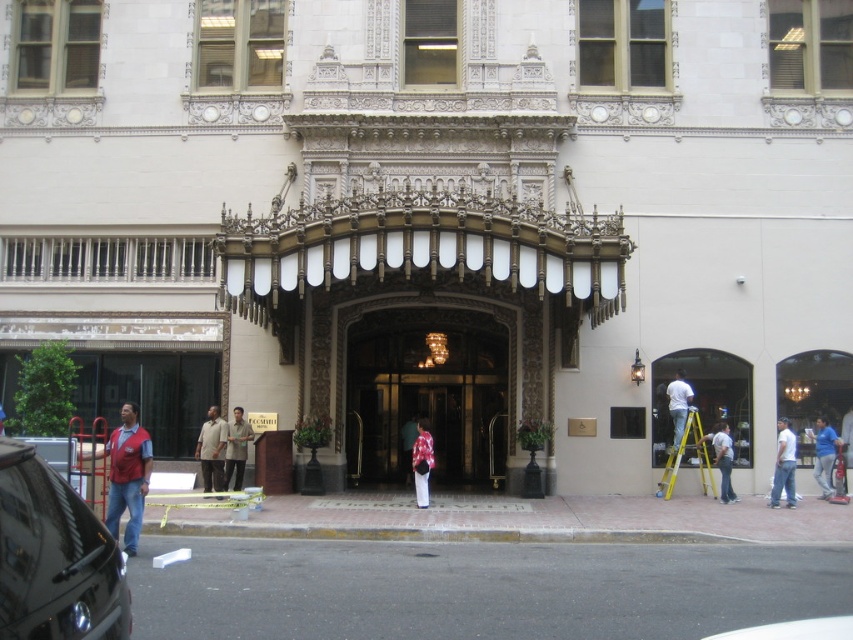
You are standing outside the grand building entrance and see both the clear glass window at center and the floral fabric dress at center. Which object is closer to you?

The clear glass window at center is closer to you because the floral fabric dress at center is behind it.

You are standing at the entrance of the grand building and want to locate two specific points marked on the facade. The first point is at coordinate point (668, 432) and the second is at point (428, 454). Which point is closer to you as you face the building?

Point (428, 454) is closer to you because it is in front of point (668, 432).

You are standing at point (730, 419). The entrance doors are 90.81 feet away from you. Can you walk to the entrance doors from your current position?

Yes, you can walk to the entrance doors from your current position at point (730, 419) since they are 90.81 feet away, which is a manageable distance for walking.